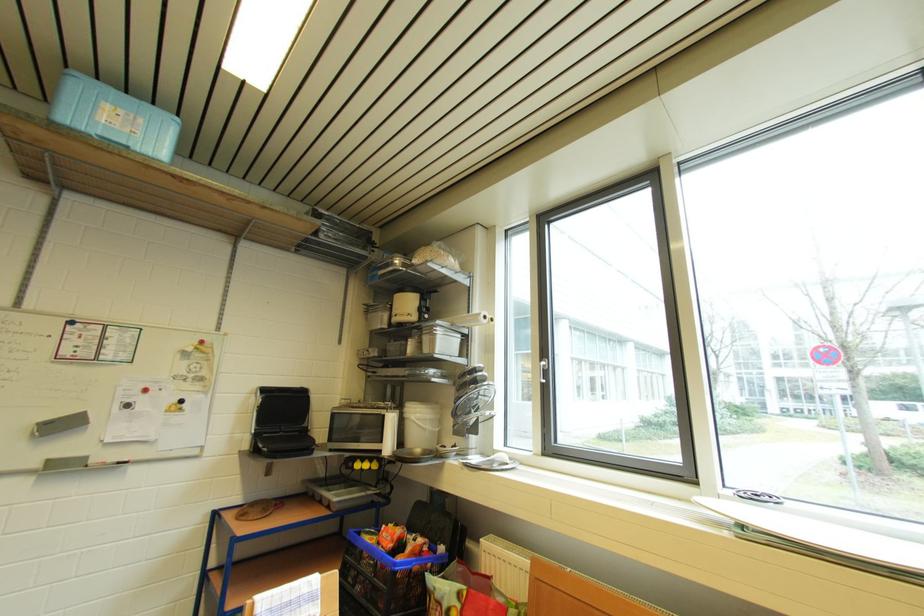
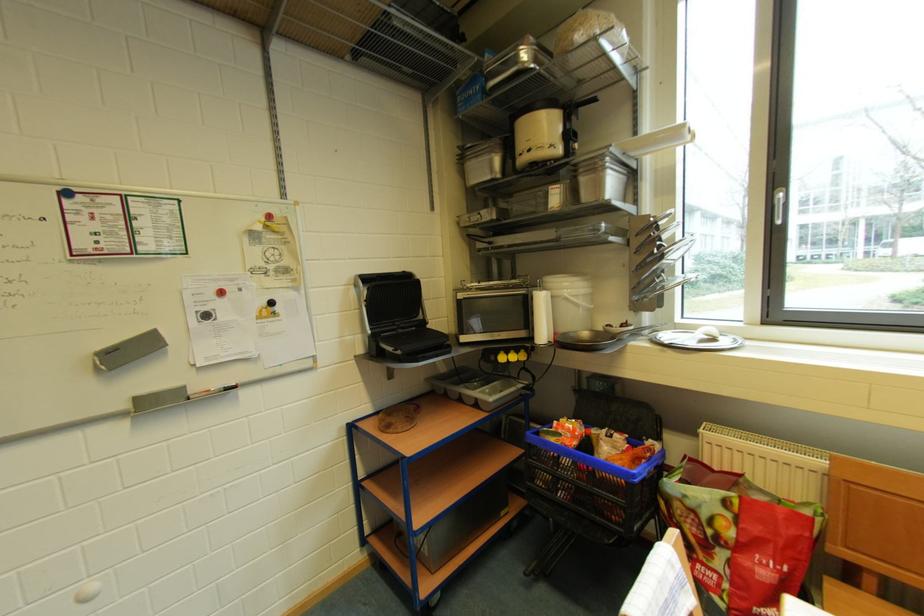
Where in the second image is the point corresponding to pixel 358 468 from the first image?

(500, 361)